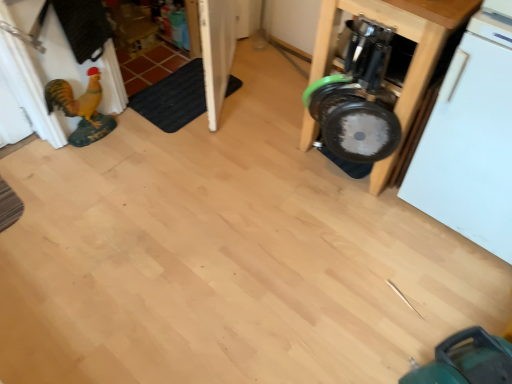
The image size is (512, 384). Identify the location of vacant space underneath black rubber mat at lower left (from a real-world perspective). (175, 98).